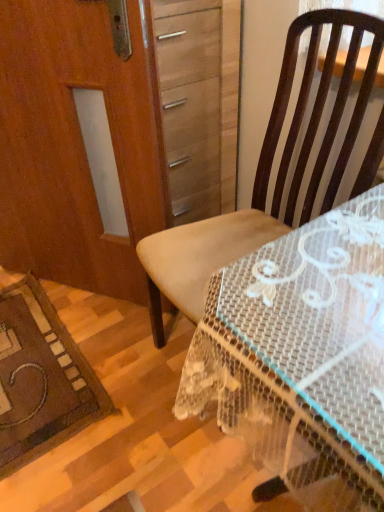
Question: Can you confirm if clear plastic table at center is shorter than wooden screen door at left?

Choices:
 (A) no
 (B) yes

Answer: (B)

Question: Is clear plastic table at center surrounding wooden screen door at left?

Choices:
 (A) no
 (B) yes

Answer: (A)

Question: Is clear plastic table at center smaller than wooden screen door at left?

Choices:
 (A) no
 (B) yes

Answer: (A)

Question: Is clear plastic table at center oriented away from wooden screen door at left?

Choices:
 (A) yes
 (B) no

Answer: (B)

Question: Does clear plastic table at center have a greater height compared to wooden screen door at left?

Choices:
 (A) no
 (B) yes

Answer: (A)

Question: Is clear plastic table at center not near wooden screen door at left?

Choices:
 (A) no
 (B) yes

Answer: (A)

Question: Could you tell me if brown fabric chair at center is facing clear plastic table at center?

Choices:
 (A) yes
 (B) no

Answer: (B)

Question: Is brown fabric chair at center to the right of clear plastic table at center from the viewer's perspective?

Choices:
 (A) no
 (B) yes

Answer: (A)

Question: Is clear plastic table at center located within brown fabric chair at center?

Choices:
 (A) no
 (B) yes

Answer: (A)

Question: Is clear plastic table at center at the back of brown fabric chair at center?

Choices:
 (A) yes
 (B) no

Answer: (B)

Question: Is brown fabric chair at center not within clear plastic table at center?

Choices:
 (A) yes
 (B) no

Answer: (A)

Question: Is brown fabric chair at center thinner than clear plastic table at center?

Choices:
 (A) no
 (B) yes

Answer: (B)

Question: From the image's perspective, is clear plastic table at center below brown fabric chair at center?

Choices:
 (A) no
 (B) yes

Answer: (B)